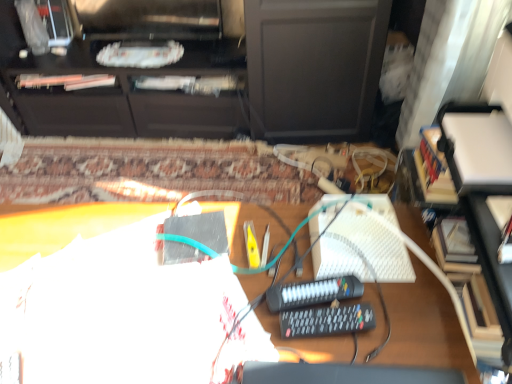
Question: Is white textured keyboard at center-right next to black matte cabinet at upper center and touching it?

Choices:
 (A) no
 (B) yes

Answer: (A)

Question: Does white textured keyboard at center-right appear on the left side of black matte cabinet at upper center?

Choices:
 (A) yes
 (B) no

Answer: (B)

Question: From a real-world perspective, is white textured keyboard at center-right positioned over black matte cabinet at upper center based on gravity?

Choices:
 (A) no
 (B) yes

Answer: (B)

Question: Does white textured keyboard at center-right come in front of black matte cabinet at upper center?

Choices:
 (A) yes
 (B) no

Answer: (A)

Question: From the image's perspective, is white textured keyboard at center-right located beneath black matte cabinet at upper center?

Choices:
 (A) no
 (B) yes

Answer: (B)

Question: Considering the relative positions of white textured keyboard at center-right and black matte cabinet at upper center in the image provided, is white textured keyboard at center-right behind black matte cabinet at upper center?

Choices:
 (A) no
 (B) yes

Answer: (A)

Question: Considering the relative sizes of black plastic remote control at center, marked as the 1th equipment in a front-to-back arrangement, and black plastic remote control at center, arranged as the 1th equipment when viewed from the back, in the image provided, is black plastic remote control at center, marked as the 1th equipment in a front-to-back arrangement, shorter than black plastic remote control at center, arranged as the 1th equipment when viewed from the back,?

Choices:
 (A) yes
 (B) no

Answer: (B)

Question: Is black plastic remote control at center, which is counted as the 2th equipment, starting from the back, turned away from black plastic remote control at center, arranged as the 1th equipment when viewed from the back?

Choices:
 (A) no
 (B) yes

Answer: (A)

Question: Does black plastic remote control at center, marked as the 1th equipment in a front-to-back arrangement, have a greater width compared to black plastic remote control at center, arranged as the 1th equipment when viewed from the back?

Choices:
 (A) no
 (B) yes

Answer: (A)

Question: Is the surface of black plastic remote control at center, marked as the 1th equipment in a front-to-back arrangement, in direct contact with black plastic remote control at center, arranged as the 1th equipment when viewed from the back?

Choices:
 (A) no
 (B) yes

Answer: (B)

Question: Can you confirm if black plastic remote control at center, which is counted as the 2th equipment, starting from the back, is smaller than black plastic remote control at center, arranged as the 1th equipment when viewed from the back?

Choices:
 (A) yes
 (B) no

Answer: (A)

Question: Does black plastic remote control at center, which is counted as the 2th equipment, starting from the back, have a lesser width compared to black plastic remote control at center, arranged as the 1th equipment when viewed from the back?

Choices:
 (A) yes
 (B) no

Answer: (A)

Question: Does black matte cabinet at upper center have a greater width compared to black plastic remote control at center, marked as the 1th equipment in a front-to-back arrangement?

Choices:
 (A) no
 (B) yes

Answer: (B)